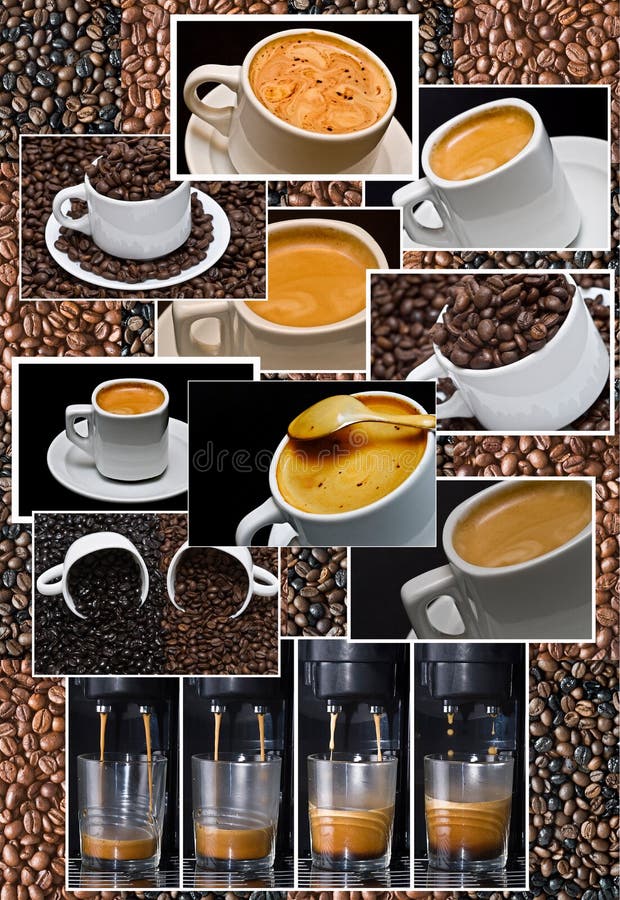
Where is `plates`? The height and width of the screenshot is (900, 620). plates is located at coordinates (166, 275), (200, 147), (578, 172), (603, 293), (136, 482), (275, 536), (445, 617).